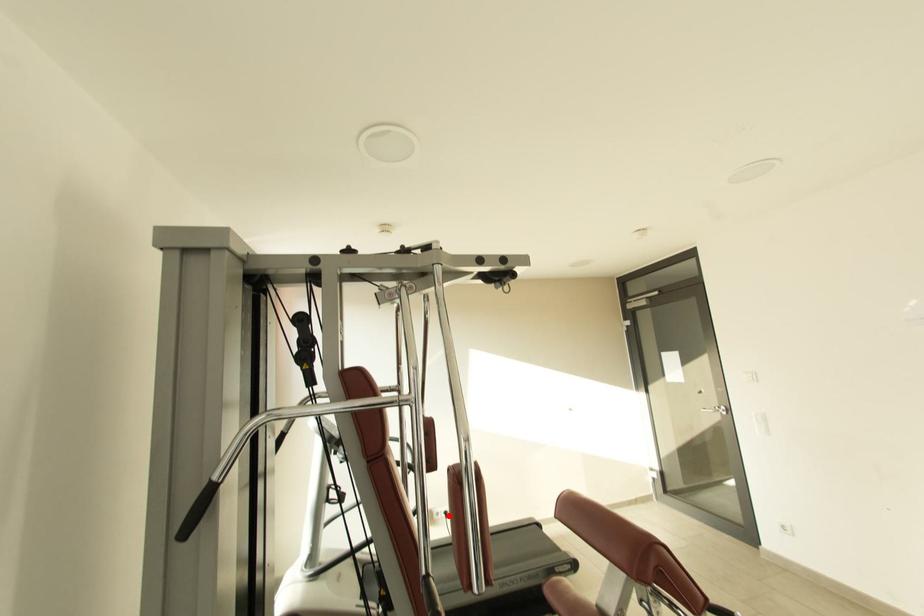
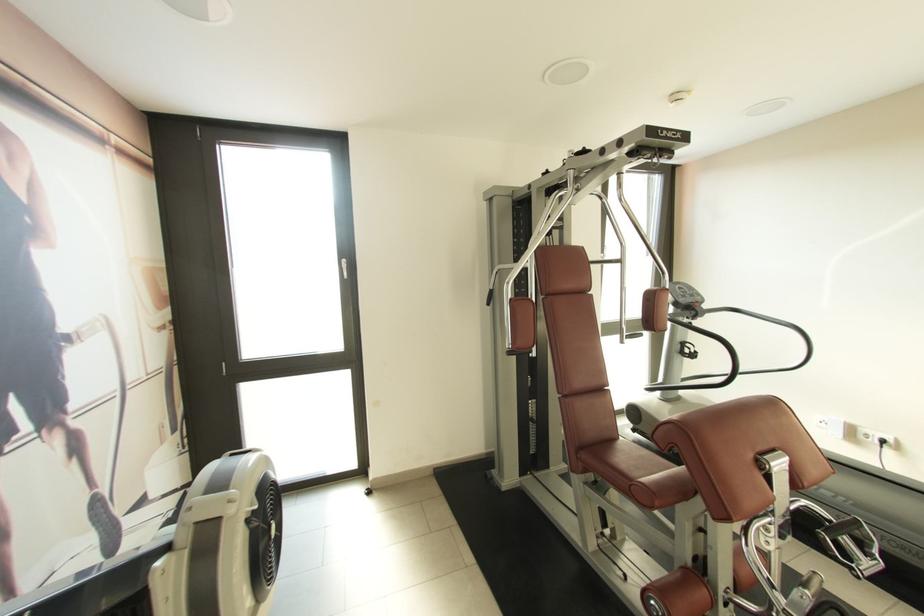
In the second image, find the point that corresponds to the highlighted location in the first image.

(882, 445)